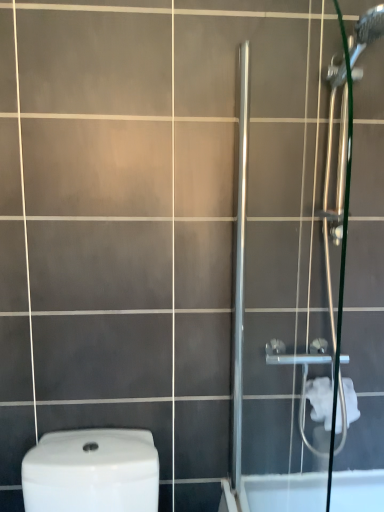
Question: Is white soft toilet paper at right bigger or smaller than satin chrome shower door at right?

Choices:
 (A) big
 (B) small

Answer: (B)

Question: Is point (307, 396) closer or farther from the camera than point (349, 159)?

Choices:
 (A) farther
 (B) closer

Answer: (A)

Question: Considering the positions of white soft toilet paper at right and satin chrome shower door at right in the image, is white soft toilet paper at right wider or thinner than satin chrome shower door at right?

Choices:
 (A) thin
 (B) wide

Answer: (B)

Question: In the image, is satin chrome shower door at right on the left side or the right side of white soft toilet paper at right?

Choices:
 (A) right
 (B) left

Answer: (B)

Question: From a real-world perspective, is satin chrome shower door at right positioned above or below white soft toilet paper at right?

Choices:
 (A) below
 (B) above

Answer: (B)

Question: In the image, is satin chrome shower door at right positioned in front of or behind white soft toilet paper at right?

Choices:
 (A) behind
 (B) front

Answer: (B)

Question: Considering the positions of satin chrome shower door at right and white soft toilet paper at right in the image, is satin chrome shower door at right taller or shorter than white soft toilet paper at right?

Choices:
 (A) short
 (B) tall

Answer: (B)